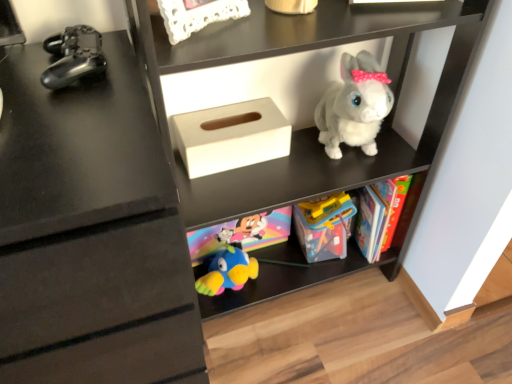
You are a GUI agent. You are given a task and a screenshot of the screen. Output one action in this format:
    pyautogui.click(x=<x>, y=<y>)
    Task: Click on the vacant area on top of white matte tissue box at center (from a real-world perspective)
    The width and height of the screenshot is (512, 384).
    Given the screenshot: What is the action you would take?
    pyautogui.click(x=242, y=122)